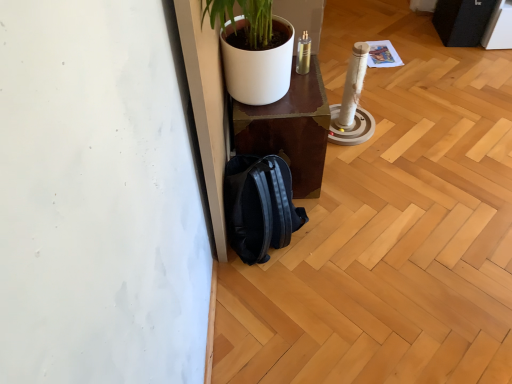
This screenshot has width=512, height=384. What are the coordinates of `free location to the right of black matte backpack at lower center` in the screenshot? It's located at (349, 235).